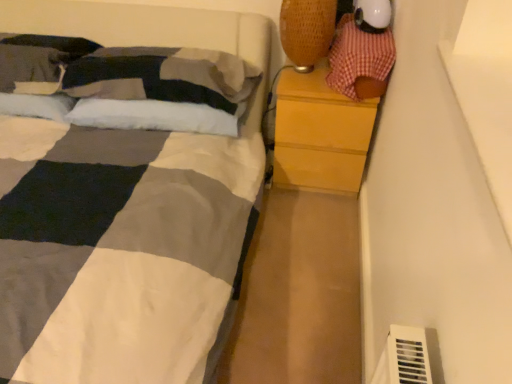
The width and height of the screenshot is (512, 384). What do you see at coordinates (362, 51) in the screenshot?
I see `checkered fabric toy at upper right` at bounding box center [362, 51].

This screenshot has height=384, width=512. What do you see at coordinates (53, 45) in the screenshot?
I see `soft cotton pillow at upper left, arranged as the 2th pillow when viewed from the right` at bounding box center [53, 45].

Locate an element on the screen. The width and height of the screenshot is (512, 384). white soft pillow at upper left, placed as the 1th pillow when sorted from right to left is located at coordinates pyautogui.click(x=160, y=89).

Describe the element at coordinates (307, 31) in the screenshot. I see `woven fabric table lamp at upper right` at that location.

Where is `checkered fabric toy at upper right`? The image size is (512, 384). checkered fabric toy at upper right is located at coordinates (362, 51).

In the scene shown: Could you tell me if wooden chest of drawers at right is facing soft cotton pillow at upper left, positioned as the 1th pillow in left-to-right order?

No, wooden chest of drawers at right is not oriented towards soft cotton pillow at upper left, positioned as the 1th pillow in left-to-right order.

Does wooden chest of drawers at right appear on the left side of soft cotton pillow at upper left, arranged as the 2th pillow when viewed from the right?

Incorrect, wooden chest of drawers at right is not on the left side of soft cotton pillow at upper left, arranged as the 2th pillow when viewed from the right.

From the image's perspective, is wooden chest of drawers at right over soft cotton pillow at upper left, arranged as the 2th pillow when viewed from the right?

No.

How many degrees apart are the facing directions of wooden chest of drawers at right and soft cotton pillow at upper left, arranged as the 2th pillow when viewed from the right?

0.00051 degrees separate the facing orientations of wooden chest of drawers at right and soft cotton pillow at upper left, arranged as the 2th pillow when viewed from the right.

Does woven fabric table lamp at upper right have a greater height compared to checkered fabric toy at upper right?

Yes, woven fabric table lamp at upper right is taller than checkered fabric toy at upper right.

Is woven fabric table lamp at upper right placed right next to checkered fabric toy at upper right?

No, woven fabric table lamp at upper right is not with checkered fabric toy at upper right.

Between point (316, 51) and point (358, 39), which one is positioned behind?

Point (316, 51)

From a real-world perspective, does woven fabric table lamp at upper right sit lower than checkered fabric toy at upper right?

No.

What are the coordinates of `table lamp that appears on the left of wooden chest of drawers at right` in the screenshot? It's located at (307, 31).

From the picture: Considering the sizes of woven fabric table lamp at upper right and wooden chest of drawers at right in the image, is woven fabric table lamp at upper right bigger or smaller than wooden chest of drawers at right?

Considering their sizes, woven fabric table lamp at upper right takes up less space than wooden chest of drawers at right.

Based on the photo, is woven fabric table lamp at upper right taller than wooden chest of drawers at right?

No.

Are woven fabric table lamp at upper right and wooden chest of drawers at right making contact?

No.

Which object is further away from the camera, woven fabric table lamp at upper right or soft cotton pillow at upper left, arranged as the 2th pillow when viewed from the right?

soft cotton pillow at upper left, arranged as the 2th pillow when viewed from the right, is further from the camera.

Between woven fabric table lamp at upper right and soft cotton pillow at upper left, arranged as the 2th pillow when viewed from the right, which one has smaller size?

With smaller size is woven fabric table lamp at upper right.

Who is taller, woven fabric table lamp at upper right or soft cotton pillow at upper left, arranged as the 2th pillow when viewed from the right?

With more height is woven fabric table lamp at upper right.

From the image's perspective, is white soft pillow at upper left, placed as the 1th pillow when sorted from right to left, below checkered fabric toy at upper right?

Indeed, from the image's perspective, white soft pillow at upper left, placed as the 1th pillow when sorted from right to left, is shown beneath checkered fabric toy at upper right.

In order to click on toy above the white soft pillow at upper left, the 2th pillow in the left-to-right sequence (from the image's perspective) in this screenshot , I will do `click(362, 51)`.

Considering the relative sizes of white soft pillow at upper left, placed as the 1th pillow when sorted from right to left, and checkered fabric toy at upper right in the image provided, is white soft pillow at upper left, placed as the 1th pillow when sorted from right to left, smaller than checkered fabric toy at upper right?

No.

Is point (194, 109) positioned before point (339, 37)?

Yes, it is.

Relative to soft cotton pillow at upper left, positioned as the 1th pillow in left-to-right order, is checkered fabric toy at upper right in front or behind?

Clearly, checkered fabric toy at upper right is in front of soft cotton pillow at upper left, positioned as the 1th pillow in left-to-right order.

Looking at their sizes, would you say checkered fabric toy at upper right is wider or thinner than soft cotton pillow at upper left, positioned as the 1th pillow in left-to-right order?

Considering their sizes, checkered fabric toy at upper right looks broader than soft cotton pillow at upper left, positioned as the 1th pillow in left-to-right order.

Between checkered fabric toy at upper right and soft cotton pillow at upper left, positioned as the 1th pillow in left-to-right order, which one appears on the left side from the viewer's perspective?

soft cotton pillow at upper left, positioned as the 1th pillow in left-to-right order.

Is checkered fabric toy at upper right with soft cotton pillow at upper left, positioned as the 1th pillow in left-to-right order?

No, checkered fabric toy at upper right is not in contact with soft cotton pillow at upper left, positioned as the 1th pillow in left-to-right order.

Considering the positions of objects white soft pillow at upper left, the 2th pillow in the left-to-right sequence, and woven fabric table lamp at upper right in the image provided, who is more to the left, white soft pillow at upper left, the 2th pillow in the left-to-right sequence, or woven fabric table lamp at upper right?

white soft pillow at upper left, the 2th pillow in the left-to-right sequence, is more to the left.

Is white soft pillow at upper left, the 2th pillow in the left-to-right sequence, taller than woven fabric table lamp at upper right?

Incorrect, the height of white soft pillow at upper left, the 2th pillow in the left-to-right sequence, is not larger of that of woven fabric table lamp at upper right.

Is woven fabric table lamp at upper right at the back of white soft pillow at upper left, placed as the 1th pillow when sorted from right to left?

No.

From a real-world perspective, is white soft pillow at upper left, the 2th pillow in the left-to-right sequence, physically below woven fabric table lamp at upper right?

Yes, from a real-world perspective, white soft pillow at upper left, the 2th pillow in the left-to-right sequence, is under woven fabric table lamp at upper right.

The image size is (512, 384). What are the coordinates of `the chest of drawers lying in front of the soft cotton pillow at upper left, positioned as the 1th pillow in left-to-right order` in the screenshot? It's located at (320, 134).

Locate an element on the screen. The width and height of the screenshot is (512, 384). table lamp above the checkered fabric toy at upper right (from a real-world perspective) is located at coordinates (307, 31).

From the image, which object appears to be farther from checkered fabric toy at upper right, soft cotton pillow at upper left, arranged as the 2th pillow when viewed from the right, or white soft pillow at upper left, the 2th pillow in the left-to-right sequence?

Based on the image, soft cotton pillow at upper left, arranged as the 2th pillow when viewed from the right, appears to be further to checkered fabric toy at upper right.

Which object lies nearer to the anchor point white soft pillow at upper left, the 2th pillow in the left-to-right sequence, soft cotton pillow at upper left, arranged as the 2th pillow when viewed from the right, or woven fabric table lamp at upper right?

soft cotton pillow at upper left, arranged as the 2th pillow when viewed from the right, lies closer to white soft pillow at upper left, the 2th pillow in the left-to-right sequence, than the other object.

Considering their positions, is checkered fabric toy at upper right positioned further to woven fabric table lamp at upper right than white soft pillow at upper left, the 2th pillow in the left-to-right sequence?

The object further to woven fabric table lamp at upper right is white soft pillow at upper left, the 2th pillow in the left-to-right sequence.

Based on their spatial positions, is woven fabric table lamp at upper right or wooden chest of drawers at right further from checkered fabric toy at upper right?

wooden chest of drawers at right is positioned further to the anchor checkered fabric toy at upper right.

Looking at the image, which one is located closer to wooden chest of drawers at right, white soft pillow at upper left, placed as the 1th pillow when sorted from right to left, or woven fabric table lamp at upper right?

woven fabric table lamp at upper right lies closer to wooden chest of drawers at right than the other object.

Looking at the image, which one is located closer to soft cotton pillow at upper left, positioned as the 1th pillow in left-to-right order, woven fabric table lamp at upper right or white soft pillow at upper left, the 2th pillow in the left-to-right sequence?

white soft pillow at upper left, the 2th pillow in the left-to-right sequence.

When comparing their distances from wooden chest of drawers at right, does woven fabric table lamp at upper right or checkered fabric toy at upper right seem further?

Based on the image, woven fabric table lamp at upper right appears to be further to wooden chest of drawers at right.

Looking at this image, based on their spatial positions, is wooden chest of drawers at right or soft cotton pillow at upper left, positioned as the 1th pillow in left-to-right order, further from white soft pillow at upper left, placed as the 1th pillow when sorted from right to left?

wooden chest of drawers at right lies further to white soft pillow at upper left, placed as the 1th pillow when sorted from right to left, than the other object.

You are a GUI agent. You are given a task and a screenshot of the screen. Output one action in this format:
    pyautogui.click(x=<x>, y=<y>)
    Task: Click on the table lamp situated between white soft pillow at upper left, the 2th pillow in the left-to-right sequence, and checkered fabric toy at upper right from left to right
    
    Given the screenshot: What is the action you would take?
    pyautogui.click(x=307, y=31)

Identify the location of the chest of drawers located between soft cotton pillow at upper left, arranged as the 2th pillow when viewed from the right, and checkered fabric toy at upper right in the left-right direction. The width and height of the screenshot is (512, 384). (320, 134).

You are a GUI agent. You are given a task and a screenshot of the screen. Output one action in this format:
    pyautogui.click(x=<x>, y=<y>)
    Task: Click on the table lamp situated between soft cotton pillow at upper left, positioned as the 1th pillow in left-to-right order, and wooden chest of drawers at right from left to right
    This screenshot has width=512, height=384.
    Given the screenshot: What is the action you would take?
    pyautogui.click(x=307, y=31)

Locate an element on the screen. This screenshot has width=512, height=384. toy between woven fabric table lamp at upper right and wooden chest of drawers at right in the up-down direction is located at coordinates (362, 51).